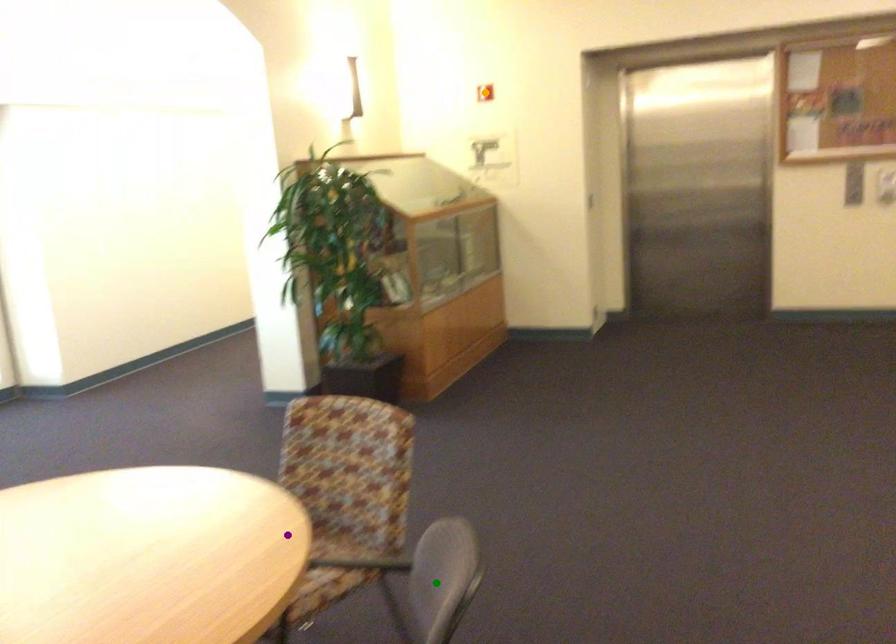
Based on the photo, order these from nearest to farthest:
- purple point
- green point
- orange point

green point
purple point
orange point